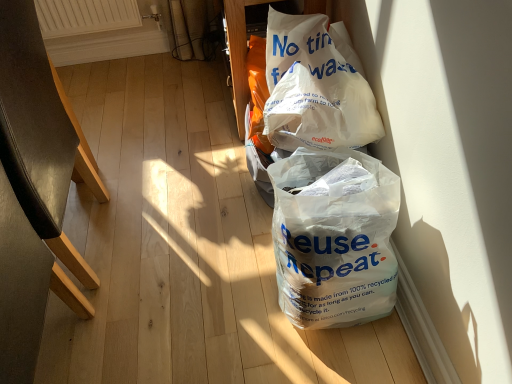
Find the location of a particular element. This screenshot has width=512, height=384. free spot below black leather chair at left (from a real-world perspective) is located at coordinates (97, 234).